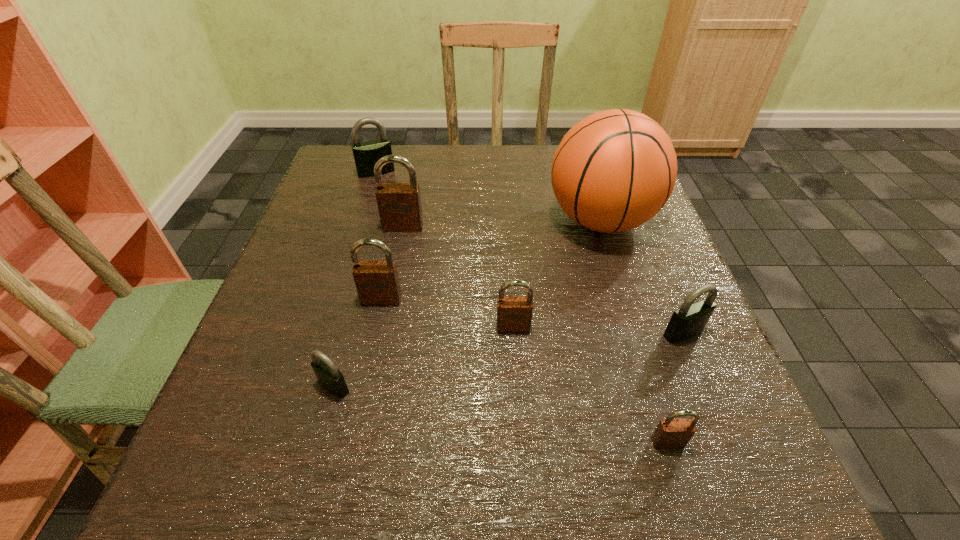
The height and width of the screenshot is (540, 960). In order to click on the tallest object in this screenshot , I will do `click(614, 170)`.

I want to click on the tallest padlock, so click(x=399, y=204).

Image resolution: width=960 pixels, height=540 pixels. What are the coordinates of `the second farthest padlock` in the screenshot? It's located at (399, 204).

The width and height of the screenshot is (960, 540). Find the location of `the biggest black padlock`. the biggest black padlock is located at coordinates (366, 154).

Where is `the farthest object`? This screenshot has width=960, height=540. the farthest object is located at coordinates (366, 154).

Where is `the fifth nearest object`? This screenshot has width=960, height=540. the fifth nearest object is located at coordinates (377, 282).

The width and height of the screenshot is (960, 540). I want to click on the third nearest brown padlock, so click(x=377, y=282).

Where is `the rightmost padlock`? The height and width of the screenshot is (540, 960). the rightmost padlock is located at coordinates (689, 320).

You are a GUI agent. You are given a task and a screenshot of the screen. Output one action in this format:
    pyautogui.click(x=<x>, y=<y>)
    Task: Click on the rightmost black padlock
    Image resolution: width=960 pixels, height=540 pixels.
    Given the screenshot: What is the action you would take?
    pyautogui.click(x=689, y=320)

Identify the location of the second nearest brown padlock. The image size is (960, 540). (x=514, y=313).